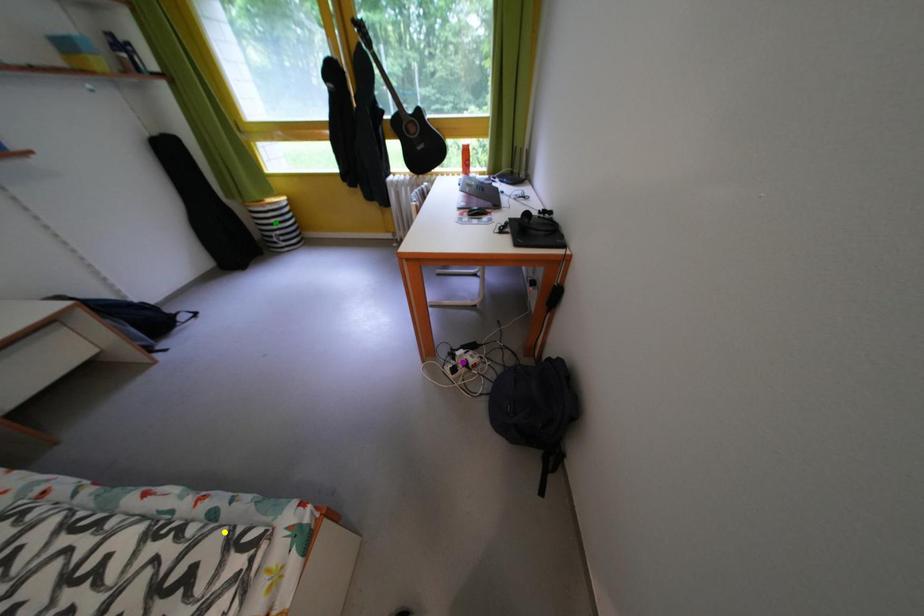
Order these from farthest to nearest:
A) purple point
B) yellow point
C) green point

green point < purple point < yellow point